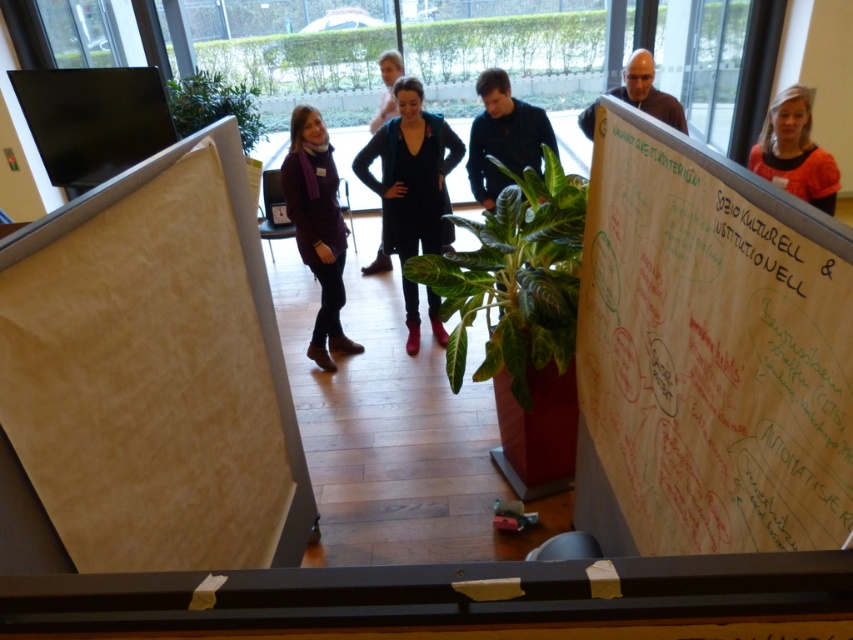
From the picture: Is matte purple sweater at center in front of white chalk writing at upper center?

No, matte purple sweater at center is further to the viewer.

Describe the element at coordinates (317, 227) in the screenshot. The height and width of the screenshot is (640, 853). I see `matte purple sweater at center` at that location.

You are a GUI agent. You are given a task and a screenshot of the screen. Output one action in this format:
    pyautogui.click(x=<x>, y=<y>)
    Task: Click on the matte purple sweater at center
    This screenshot has height=640, width=853.
    Given the screenshot: What is the action you would take?
    pyautogui.click(x=317, y=227)

Which is in front, point (788, 88) or point (677, 173)?

Positioned in front is point (677, 173).

Which of these two, orange matte shirt at upper right or white chalk writing at upper center, stands shorter?

Standing shorter between the two is white chalk writing at upper center.

What do you see at coordinates (793, 150) in the screenshot? I see `orange matte shirt at upper right` at bounding box center [793, 150].

Identify the location of orange matte shirt at upper right. (793, 150).

Is velvet black dress at center below green leafy plant at upper left?

Yes, velvet black dress at center is below green leafy plant at upper left.

Is point (395, 88) positioned in front of point (213, 81)?

That is True.

Is point (381, 134) positioned before point (248, 116)?

Yes.

Locate an element on the screen. The width and height of the screenshot is (853, 640). velvet black dress at center is located at coordinates (410, 173).